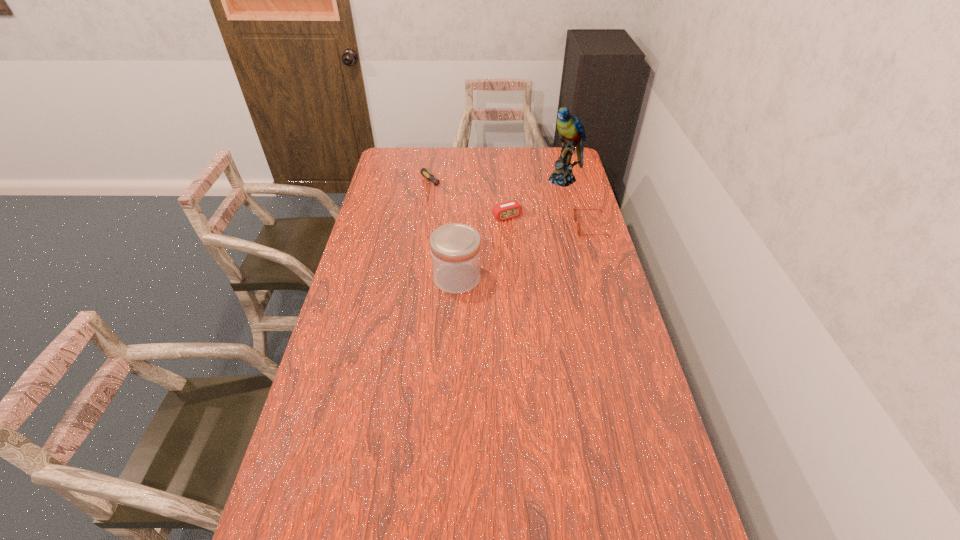
In order to click on free area in between the alarm clock and the shortest object in this screenshot , I will do `click(471, 201)`.

The width and height of the screenshot is (960, 540). In order to click on free space between the tallest object and the nearest object in this screenshot , I will do `click(512, 229)`.

Locate an element on the screen. empty space that is in between the second shortest object and the third object from right to left is located at coordinates (549, 221).

At what (x,y) coordinates should I click in order to perform the action: click on vacant area between the third object from right to left and the screwdriver. Please return your answer as a coordinate pair (x, y). The width and height of the screenshot is (960, 540). Looking at the image, I should click on (471, 201).

Locate an element on the screen. The image size is (960, 540). free spot between the nearest object and the third shortest object is located at coordinates (482, 247).

Locate an element on the screen. unoccupied area between the fourth tallest object and the alarm clock is located at coordinates (549, 221).

Where is `vacant area between the jar and the third tallest object`? Image resolution: width=960 pixels, height=540 pixels. vacant area between the jar and the third tallest object is located at coordinates (482, 247).

Locate an element on the screen. The width and height of the screenshot is (960, 540). empty location between the sunglasses and the alarm clock is located at coordinates (549, 221).

At what (x,y) coordinates should I click in order to perform the action: click on free space that is in between the fourth tallest object and the third object from right to left. Please return your answer as a coordinate pair (x, y). Looking at the image, I should click on (549, 221).

Locate an element on the screen. object that stands as the third closest to the jar is located at coordinates (429, 176).